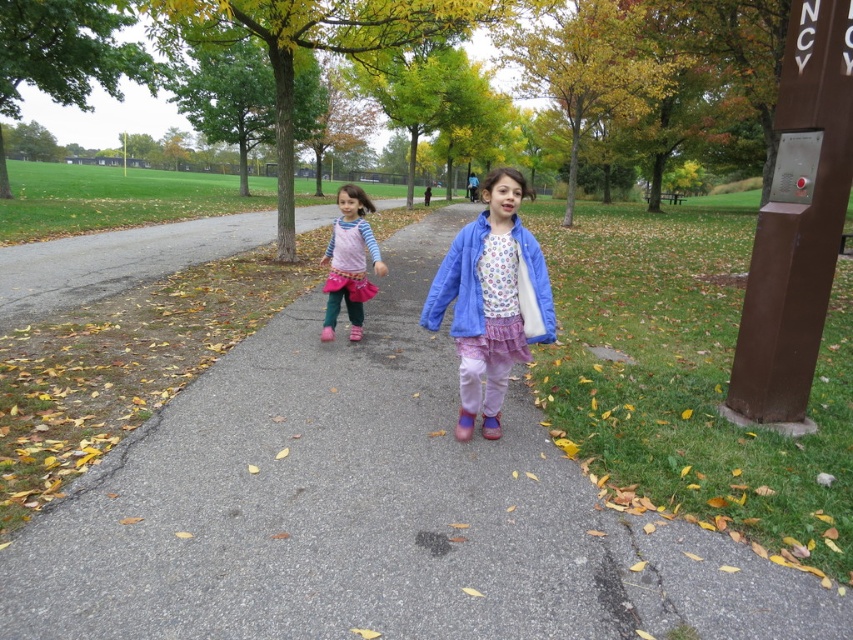
Does gray asphalt pavement at center have a greater width compared to matte blue jacket at center?

Yes, gray asphalt pavement at center is wider than matte blue jacket at center.

Is point (471, 534) in front of point (543, 301)?

Yes, it is in front of point (543, 301).

What do you see at coordinates (372, 509) in the screenshot? I see `gray asphalt pavement at center` at bounding box center [372, 509].

Find the location of a particular element. This screenshot has height=640, width=853. gray asphalt pavement at center is located at coordinates (372, 509).

Is point (440, 269) closer to camera compared to point (367, 209)?

Yes.

Is matte blue jacket at center below matte pink skirt at center?

Correct, matte blue jacket at center is located below matte pink skirt at center.

You are a GUI agent. You are given a task and a screenshot of the screen. Output one action in this format:
    pyautogui.click(x=<x>, y=<y>)
    Task: Click on the matte blue jacket at center
    
    Given the screenshot: What is the action you would take?
    click(x=457, y=282)

Can you confirm if gray asphalt pavement at center is taller than matte pink skirt at center?

Correct, gray asphalt pavement at center is much taller as matte pink skirt at center.

Between point (135, 499) and point (375, 243), which one is positioned behind?

The point (375, 243) is more distant.

Image resolution: width=853 pixels, height=640 pixels. Identify the location of gray asphalt pavement at center. (372, 509).